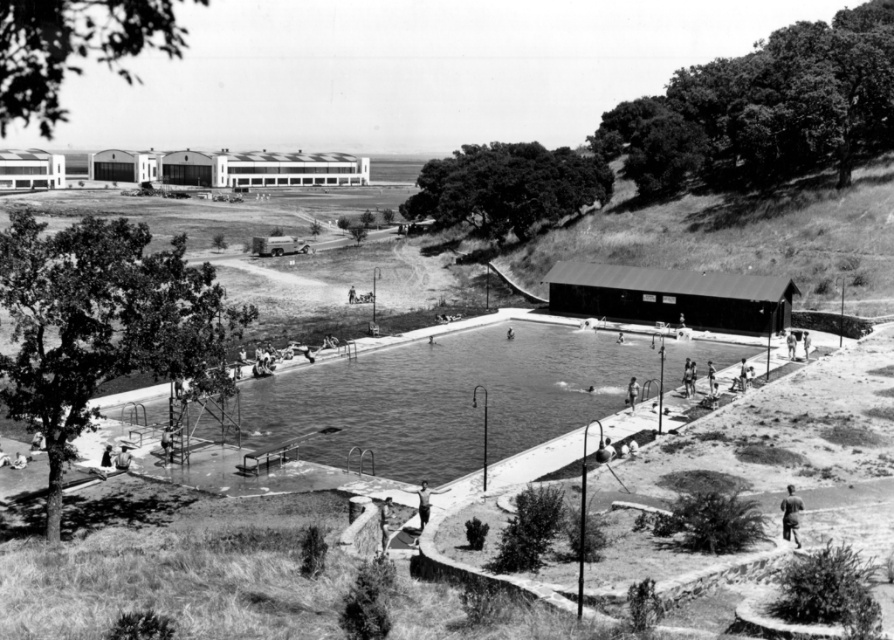
Measure the distance from light brown wooden bench at lower right to smooth skin person at lower right.

They are 85.77 centimeters apart.

Is point (795, 336) closer to camera compared to point (805, 342)?

No, it is not.

This screenshot has height=640, width=894. What are the coordinates of `light brown wooden bench at lower right` in the screenshot? It's located at (791, 344).

Can you confirm if smooth concrete pool at center is bigger than smooth skin person at lower center?

Correct, smooth concrete pool at center is larger in size than smooth skin person at lower center.

Is smooth concrete pool at center taller than smooth skin person at lower center?

Yes, smooth concrete pool at center is taller than smooth skin person at lower center.

Locate an element on the screen. This screenshot has height=640, width=894. smooth concrete pool at center is located at coordinates (449, 396).

Can you confirm if smooth concrete pool at center is positioned below smooth skin person at lower left?

Incorrect, smooth concrete pool at center is not positioned below smooth skin person at lower left.

Does smooth concrete pool at center lie in front of smooth skin person at lower left?

Yes, it is in front of smooth skin person at lower left.

Is point (401, 426) less distant than point (107, 454)?

No, it is behind (107, 454).

Where is `smooth concrete pool at center`? This screenshot has height=640, width=894. smooth concrete pool at center is located at coordinates (449, 396).